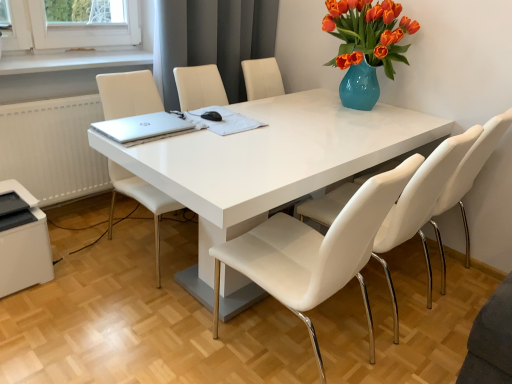
This screenshot has height=384, width=512. I want to click on vacant location below white leather chair at center, which is the 2th chair from right to left (from a real-world perspective), so click(306, 361).